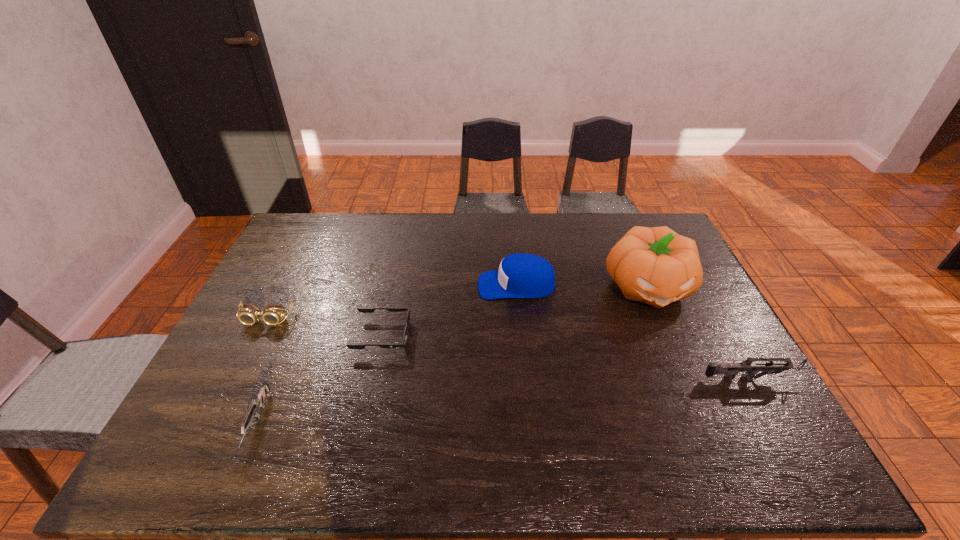
Find the location of `vacant space that is in between the nearer gun and the fifth farthest object`. vacant space that is in between the nearer gun and the fifth farthest object is located at coordinates (506, 401).

I want to click on free space between the left gun and the goggles, so click(261, 372).

At what (x,y) coordinates should I click in order to perform the action: click on unoccupied area between the baseball cap and the right gun. Please return your answer as a coordinate pair (x, y). The image size is (960, 540). Looking at the image, I should click on (636, 332).

Where is `free space between the leftmost object and the left gun`? Image resolution: width=960 pixels, height=540 pixels. free space between the leftmost object and the left gun is located at coordinates (261, 372).

Identify the location of unoccupied area between the third object from left to right and the nearer gun. The width and height of the screenshot is (960, 540). (320, 380).

Where is `object that can be found as the third closest to the taller gun`? object that can be found as the third closest to the taller gun is located at coordinates (361, 309).

Identify which object is located as the second nearest to the third object from right to left. Please provide its 2D coordinates. Your answer should be formatted as a tuple, i.e. [(x, y)], where the tuple contains the x and y coordinates of a point satisfying the conditions above.

[(361, 309)]

This screenshot has width=960, height=540. In order to click on vacant area that satisfies the following two spatial constraints: 1. on the front-facing side of the baseball cap; 2. through the lenses of the leftmost object in this screenshot , I will do `click(520, 319)`.

Locate an element on the screen. This screenshot has height=540, width=960. vacant point that satisfies the following two spatial constraints: 1. on the front-facing side of the second tallest object; 2. through the lenses of the goggles is located at coordinates (520, 319).

This screenshot has width=960, height=540. In order to click on vacant region that satisfies the following two spatial constraints: 1. on the front-facing side of the baseball cap; 2. aimed along the barrel of the fifth object from right to left in this screenshot , I will do `click(530, 423)`.